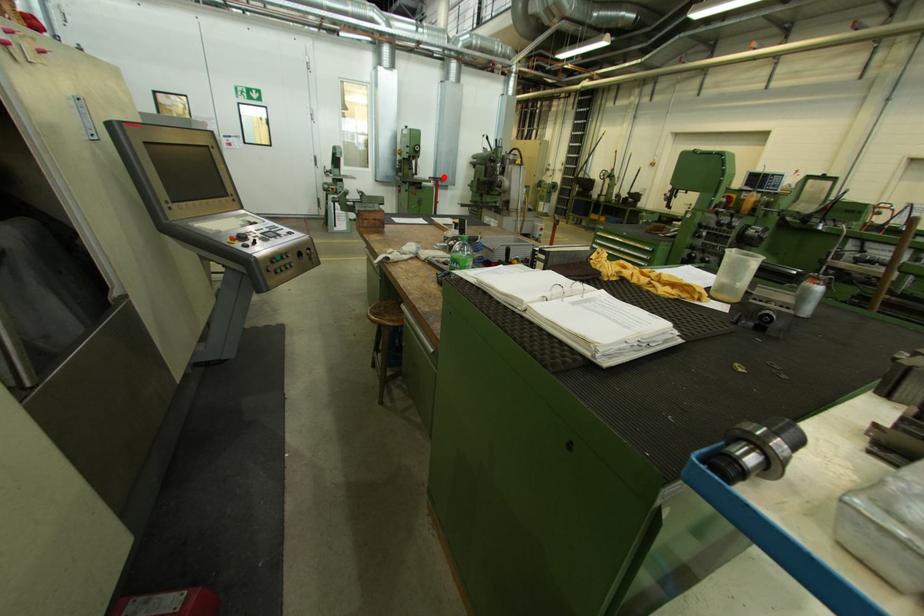
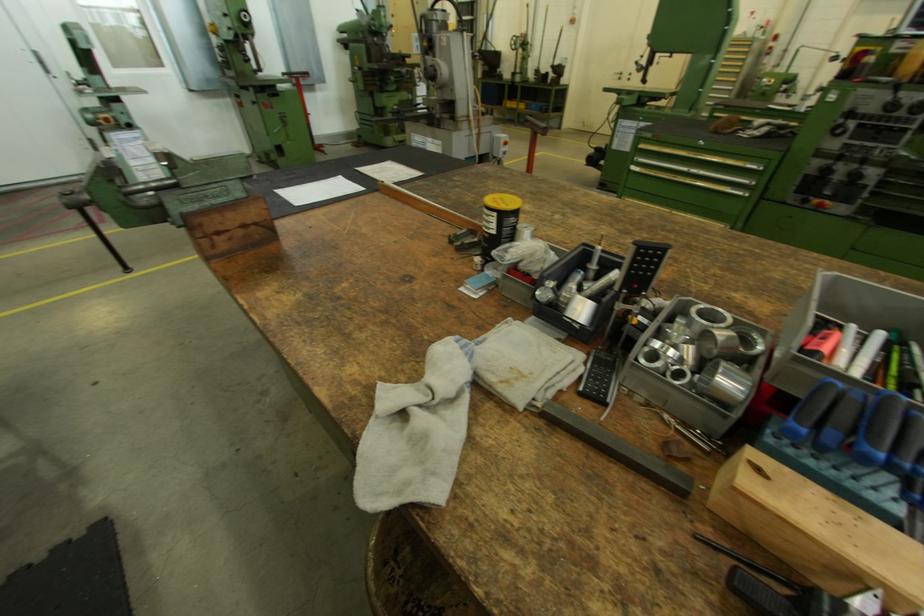
Question: I am providing you with two images of the same scene from different viewpoints. A red point is shown in image1. For the corresponding object point in image2, is it positioned nearer or farther from the camera?

Choices:
 (A) Nearer
 (B) Farther

Answer: (B)